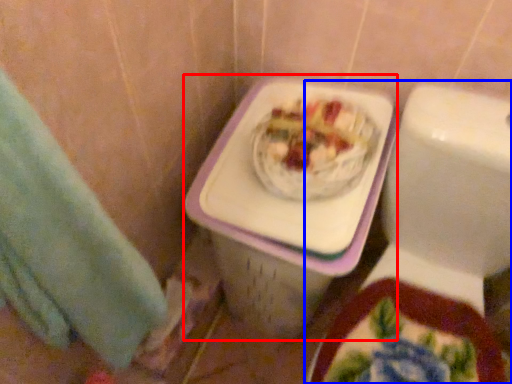
Question: Among these objects, which one is nearest to the camera, porcelain (highlighted by a red box) or toilet (highlighted by a blue box)?

Choices:
 (A) porcelain
 (B) toilet

Answer: (B)